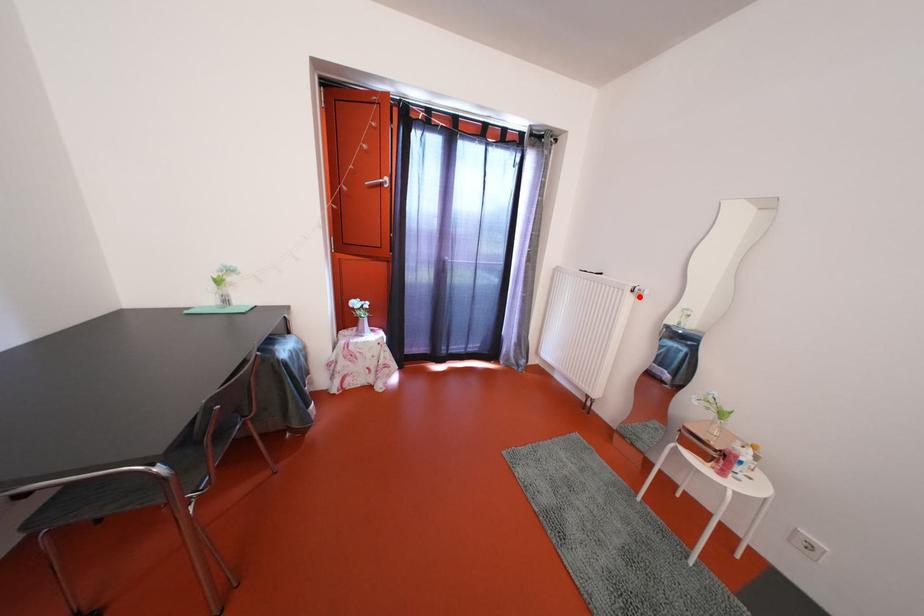
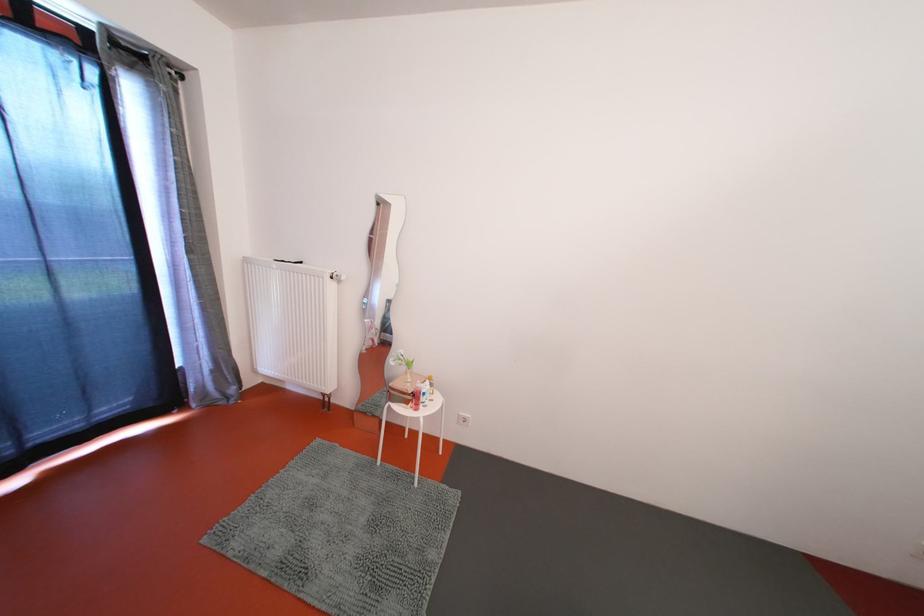
In the second image, find the point that corresponds to the highlighted location in the first image.

(338, 283)